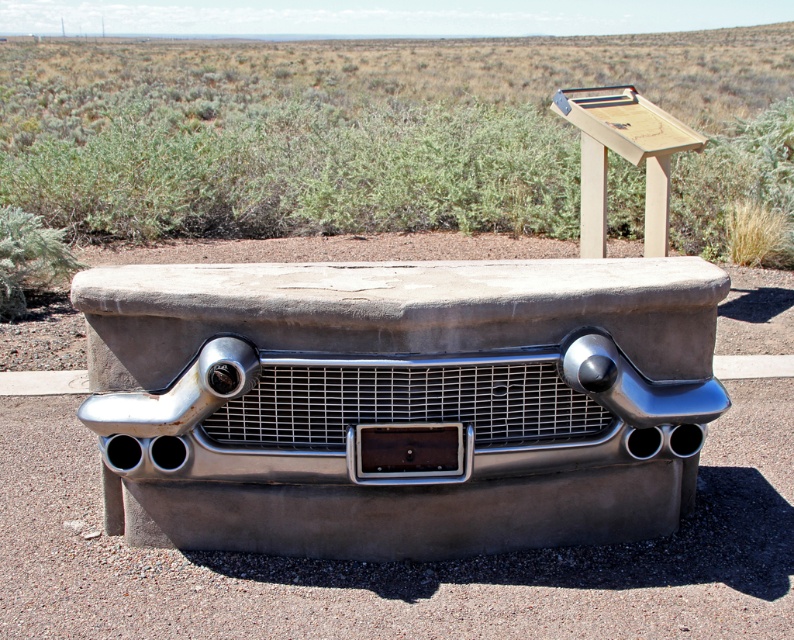
From the picture: Does polished chrome car at center have a lesser width compared to smooth concrete bumper at center?

Yes, polished chrome car at center is thinner than smooth concrete bumper at center.

Which is above, polished chrome car at center or smooth concrete bumper at center?

polished chrome car at center

The height and width of the screenshot is (640, 794). What do you see at coordinates (399, 403) in the screenshot? I see `polished chrome car at center` at bounding box center [399, 403].

What are the coordinates of `polished chrome car at center` in the screenshot? It's located at (399, 403).